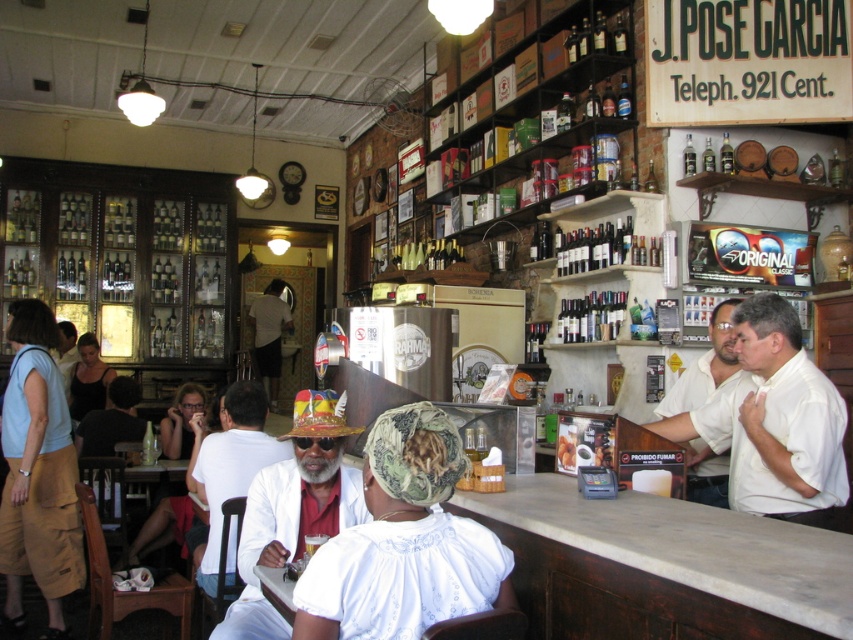
Can you confirm if white matte hat at center is thinner than white shirt at center?

Yes, white matte hat at center is thinner than white shirt at center.

Can you confirm if white matte hat at center is bigger than white shirt at center?

Actually, white matte hat at center might be smaller than white shirt at center.

I want to click on white matte hat at center, so click(293, 509).

This screenshot has width=853, height=640. Find the location of `white matte hat at center`. white matte hat at center is located at coordinates (293, 509).

Describe the element at coordinates (231, 472) in the screenshot. The image size is (853, 640). I see `white shirt at center` at that location.

The image size is (853, 640). Describe the element at coordinates (231, 472) in the screenshot. I see `white shirt at center` at that location.

I want to click on white shirt at center, so click(x=231, y=472).

Does white shirt at bar have a greater height compared to white shirt at right?

No.

In the scene shown: Does white shirt at bar appear under white shirt at right?

Yes.

Which is behind, point (647, 428) or point (729, 362)?

The point (729, 362) is behind.

Locate an element on the screen. The image size is (853, 640). white shirt at bar is located at coordinates coord(775,422).